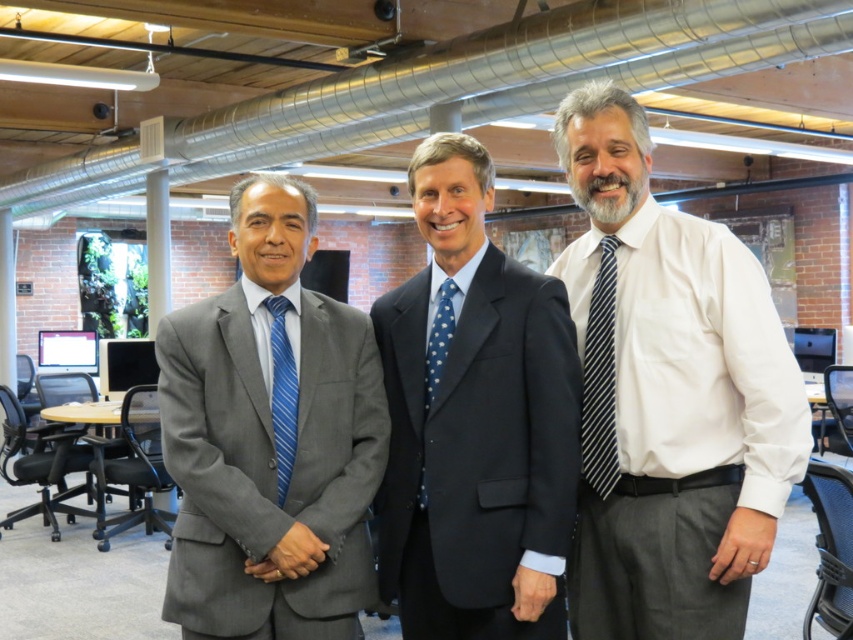
Between white striped tie at center and blue dotted fabric tie at center, which one has more height?

white striped tie at center

Is white striped tie at center above blue dotted fabric tie at center?

Answer: Correct, white striped tie at center is located above blue dotted fabric tie at center.

Where is `white striped tie at center`? The image size is (853, 640). white striped tie at center is located at coordinates (668, 396).

Consider the image. Is blue striped tie at right bigger than blue dotted fabric tie at center?

Yes, blue striped tie at right is bigger than blue dotted fabric tie at center.

This screenshot has width=853, height=640. I want to click on blue striped tie at right, so click(x=601, y=378).

I want to click on blue striped tie at right, so click(601, 378).

Based on the photo, does white striped tie at center have a smaller size compared to dark blue suit at center?

No, white striped tie at center is not smaller than dark blue suit at center.

Who is positioned more to the left, white striped tie at center or dark blue suit at center?

Positioned to the left is dark blue suit at center.

At what (x,y) coordinates should I click in order to perform the action: click on white striped tie at center. Please return your answer as a coordinate pair (x, y). Looking at the image, I should click on (668, 396).

Locate an element on the screen. The width and height of the screenshot is (853, 640). white striped tie at center is located at coordinates (668, 396).